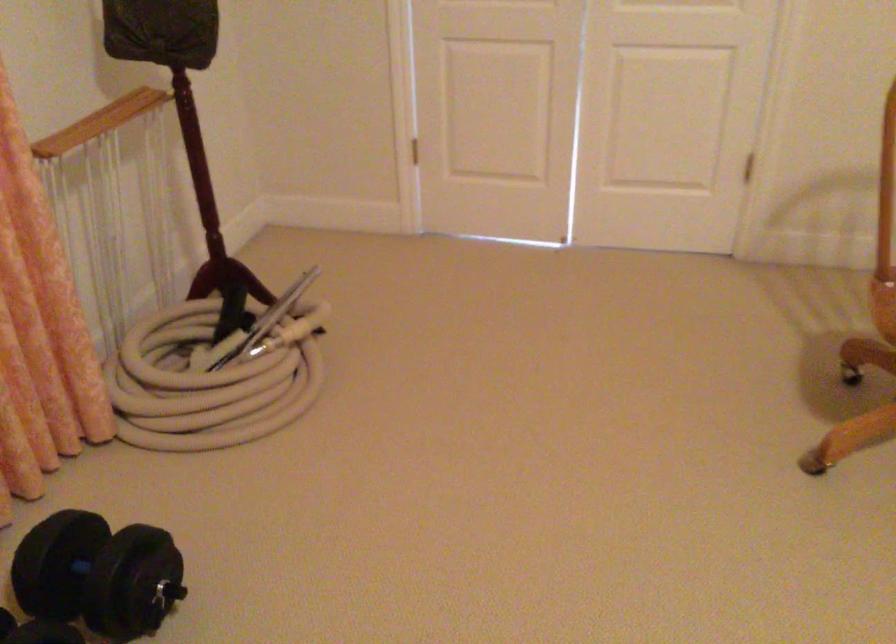
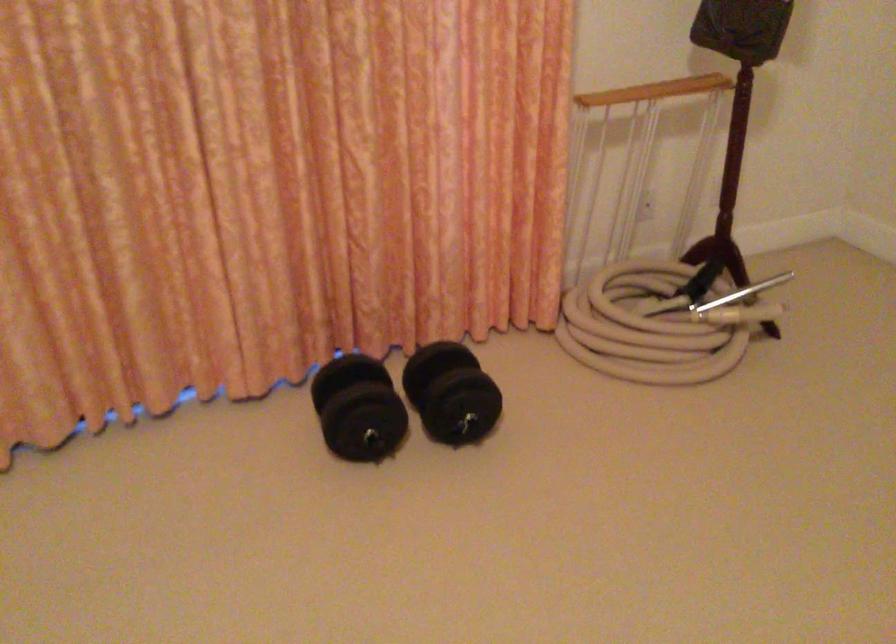
Locate, in the second image, the point that corresponds to pixel 85 570 in the first image.

(451, 393)